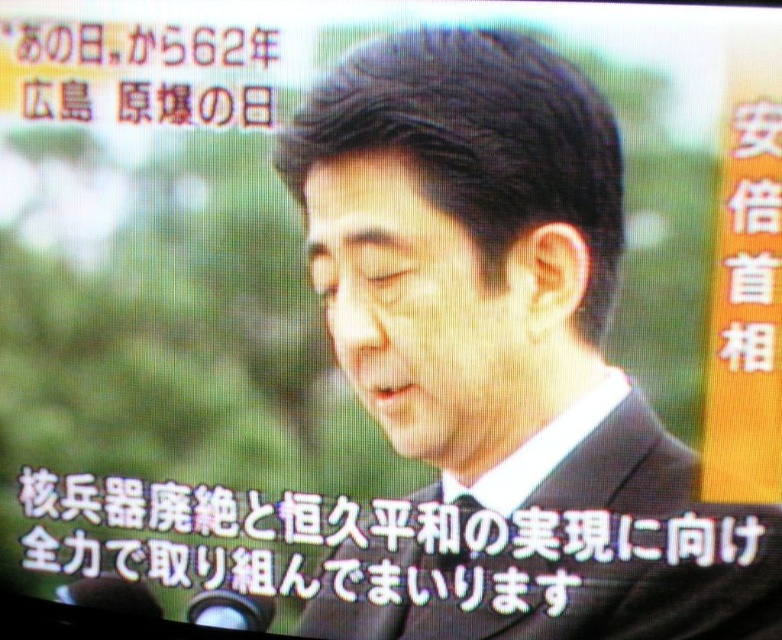
Is black suit at center further to the viewer compared to black matte text at lower center?

No, black suit at center is closer to the viewer.

Does black suit at center have a smaller size compared to black matte text at lower center?

Actually, black suit at center might be larger than black matte text at lower center.

Is point (339, 312) behind point (723, 509)?

That is False.

What are the coordinates of `black suit at center` in the screenshot? It's located at (501, 360).

Between black suit at center and black matte suit at center, which one has less height?

With less height is black matte suit at center.

Does black suit at center appear under black matte suit at center?

Incorrect, black suit at center is not positioned below black matte suit at center.

This screenshot has height=640, width=782. Identify the location of black suit at center. (501, 360).

Can you confirm if black matte suit at center is taller than black matte text at lower center?

Yes.

Is black matte suit at center to the left of black matte text at lower center from the viewer's perspective?

Incorrect, black matte suit at center is not on the left side of black matte text at lower center.

Where is `black matte suit at center`? This screenshot has height=640, width=782. black matte suit at center is located at coordinates (562, 545).